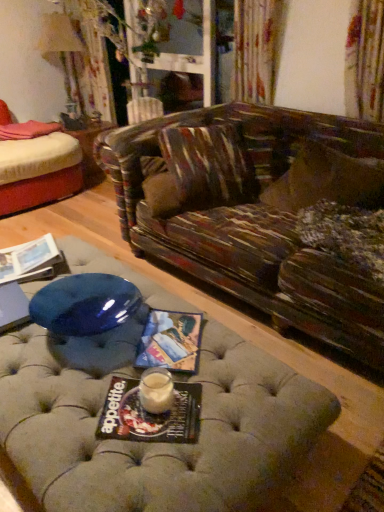
Locate an element on the screen. vacant space situated above matte paper magazine at lower left, which is the first magazine from top to bottom (from a real-world perspective) is located at coordinates (33, 256).